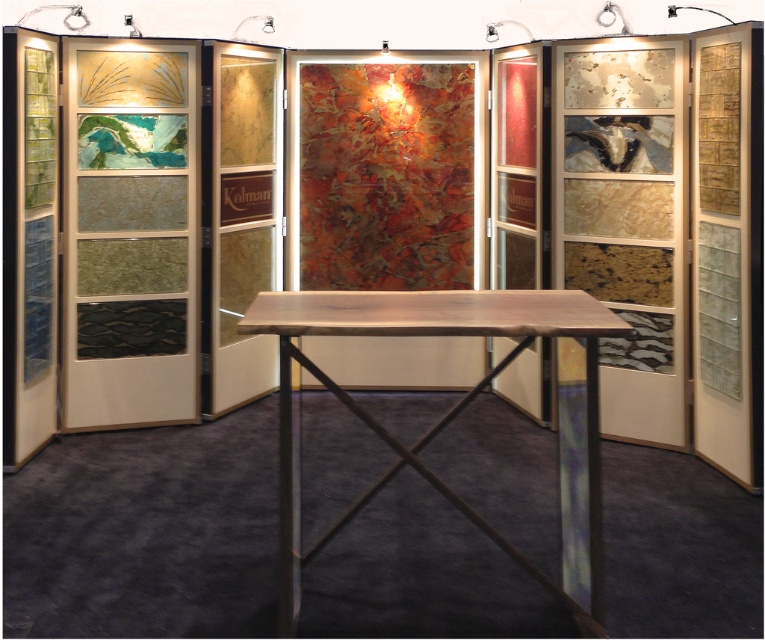
You are an event organizer who needs to move a 6.5 feet long banner from the translucent glass at left to the wooden table at center. Is there enough space to move it without bending the banner?

The distance between the translucent glass at left and the wooden table at center is 7.39 feet, which is longer than the banner length of 6.5 feet. Therefore, you can move the banner without bending it.

You are setting up a display at the exhibition booth and need to place a decorative item on the translucent glass at left and the wooden table at center. Which surface can accommodate a larger object?

The wooden table at center can accommodate a larger object since it is bigger than the translucent glass at left.

You are standing at the center of the exhibition booth and want to locate the translucent glass at left. Which direction should you face to see it?

The translucent glass at left is located at point (129, 234), so facing the left side of the booth will allow you to see it.